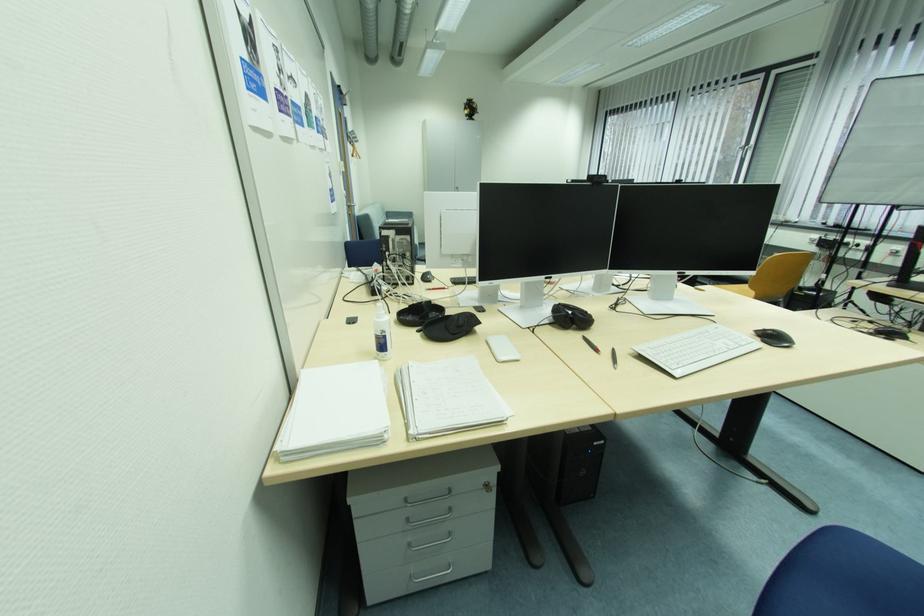
The image size is (924, 616). What do you see at coordinates (843, 578) in the screenshot?
I see `the blue chair sitting surface` at bounding box center [843, 578].